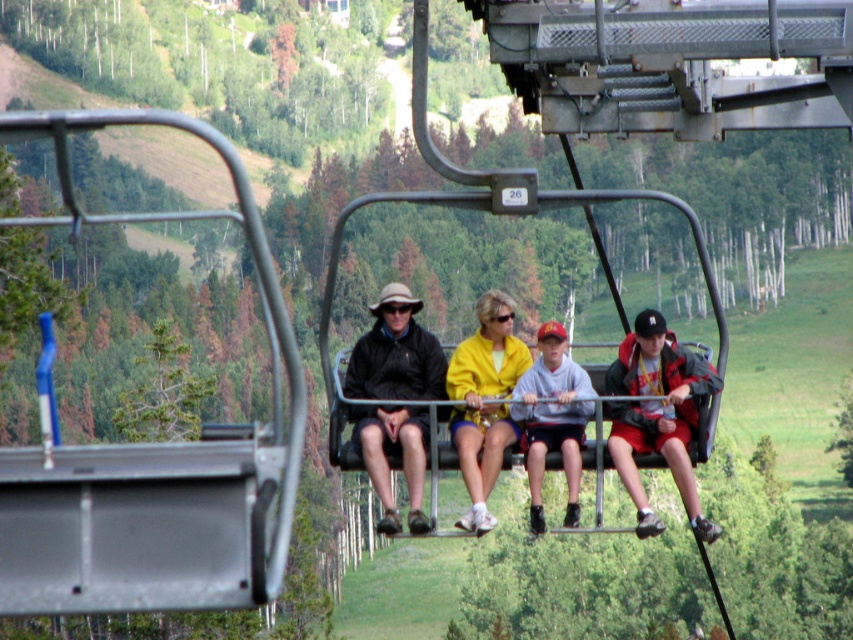
Looking at this image, you are planning to take a photo of the red jacket at right and the gray fleece sweatshirt at center from the front. Which one will appear larger in the photo?

The red jacket at right is taller than gray fleece sweatshirt at center, so it will appear larger in the photo.

What are the coordinates of the matte black jacket at center?

The coordinates of the matte black jacket at center are at point (396, 353).